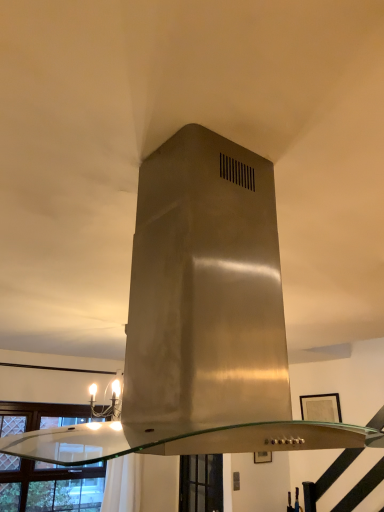
What do you see at coordinates (201, 483) in the screenshot?
I see `clear glass window at lower center, positioned as the first window in right-to-left order` at bounding box center [201, 483].

Locate an element on the screen. Image resolution: width=384 pixels, height=512 pixels. clear glass window at lower center, which is counted as the 2th window, starting from the left is located at coordinates (201, 483).

What is the approximate width of clear glass window at lower left, which is counted as the 1th window, starting from the left?

clear glass window at lower left, which is counted as the 1th window, starting from the left, is 6.08 inches in width.

I want to click on clear glass window at lower left, which is counted as the 1th window, starting from the left, so click(x=49, y=486).

What do you see at coordinates (49, 486) in the screenshot?
I see `clear glass window at lower left, placed as the 2th window when sorted from right to left` at bounding box center [49, 486].

In order to face clear glass window at lower left, placed as the 2th window when sorted from right to left, should I rotate leftwards or rightwards?

It's best to rotate left around 17.975 degrees.

What are the coordinates of `clear glass window at lower center, which is counted as the 2th window, starting from the left` in the screenshot? It's located at (201, 483).

Can you confirm if clear glass window at lower center, which is counted as the 2th window, starting from the left, is positioned to the right of clear glass window at lower left, placed as the 2th window when sorted from right to left?

Yes, clear glass window at lower center, which is counted as the 2th window, starting from the left, is to the right of clear glass window at lower left, placed as the 2th window when sorted from right to left.

In the image, is clear glass window at lower center, which is counted as the 2th window, starting from the left, positioned in front of or behind clear glass window at lower left, which is counted as the 1th window, starting from the left?

clear glass window at lower center, which is counted as the 2th window, starting from the left, is behind clear glass window at lower left, which is counted as the 1th window, starting from the left.

Is point (206, 478) farther from camera compared to point (32, 496)?

That is True.

From the image's perspective, which one is positioned higher, clear glass window at lower center, positioned as the first window in right-to-left order, or clear glass window at lower left, which is counted as the 1th window, starting from the left?

clear glass window at lower left, which is counted as the 1th window, starting from the left, appears higher in the image.

From a real-world perspective, which is physically below, clear glass window at lower center, which is counted as the 2th window, starting from the left, or clear glass window at lower left, which is counted as the 1th window, starting from the left?

clear glass window at lower center, which is counted as the 2th window, starting from the left.

Is clear glass window at lower center, positioned as the first window in right-to-left order, wider than clear glass window at lower left, placed as the 2th window when sorted from right to left?

No.

Can you confirm if clear glass window at lower center, positioned as the first window in right-to-left order, is taller than clear glass window at lower left, which is counted as the 1th window, starting from the left?

No.

In the scene shown: Can you confirm if clear glass window at lower center, positioned as the first window in right-to-left order, is smaller than clear glass window at lower left, which is counted as the 1th window, starting from the left?

Yes.

Would you say clear glass window at lower center, positioned as the first window in right-to-left order, contains clear glass window at lower left, which is counted as the 1th window, starting from the left?

No, clear glass window at lower center, positioned as the first window in right-to-left order, does not contain clear glass window at lower left, which is counted as the 1th window, starting from the left.

Is there a large distance between clear glass window at lower center, which is counted as the 2th window, starting from the left, and clear glass window at lower left, placed as the 2th window when sorted from right to left?

clear glass window at lower center, which is counted as the 2th window, starting from the left, is positioned a significant distance from clear glass window at lower left, placed as the 2th window when sorted from right to left.

Could you tell me if clear glass window at lower center, which is counted as the 2th window, starting from the left, is turned towards clear glass window at lower left, which is counted as the 1th window, starting from the left?

Yes, clear glass window at lower center, which is counted as the 2th window, starting from the left, is turned towards clear glass window at lower left, which is counted as the 1th window, starting from the left.

How different are the orientations of clear glass window at lower center, which is counted as the 2th window, starting from the left, and clear glass window at lower left, which is counted as the 1th window, starting from the left, in degrees?

90.1 degrees.

How far apart are clear glass window at lower center, positioned as the first window in right-to-left order, and clear glass window at lower left, placed as the 2th window when sorted from right to left?

clear glass window at lower center, positioned as the first window in right-to-left order, and clear glass window at lower left, placed as the 2th window when sorted from right to left, are 1.18 meters apart.

This screenshot has width=384, height=512. What are the coordinates of `window on the left of clear glass window at lower center, positioned as the first window in right-to-left order` in the screenshot? It's located at (49, 486).

Based on the photo, which is more to the left, clear glass window at lower left, which is counted as the 1th window, starting from the left, or clear glass window at lower center, positioned as the first window in right-to-left order?

From the viewer's perspective, clear glass window at lower left, which is counted as the 1th window, starting from the left, appears more on the left side.

Is clear glass window at lower left, placed as the 2th window when sorted from right to left, positioned in front of clear glass window at lower center, positioned as the first window in right-to-left order?

Yes, the depth of clear glass window at lower left, placed as the 2th window when sorted from right to left, is less than that of clear glass window at lower center, positioned as the first window in right-to-left order.

Does point (76, 509) come in front of point (186, 477)?

Yes, point (76, 509) is closer to viewer.

From the image's perspective, does clear glass window at lower left, placed as the 2th window when sorted from right to left, appear lower than clear glass window at lower center, which is counted as the 2th window, starting from the left?

Actually, clear glass window at lower left, placed as the 2th window when sorted from right to left, appears above clear glass window at lower center, which is counted as the 2th window, starting from the left, in the image.

From a real-world perspective, which is physically above, clear glass window at lower left, which is counted as the 1th window, starting from the left, or clear glass window at lower center, which is counted as the 2th window, starting from the left?

clear glass window at lower left, which is counted as the 1th window, starting from the left.

From the picture: Does clear glass window at lower left, which is counted as the 1th window, starting from the left, have a greater width compared to clear glass window at lower center, which is counted as the 2th window, starting from the left?

Correct, the width of clear glass window at lower left, which is counted as the 1th window, starting from the left, exceeds that of clear glass window at lower center, which is counted as the 2th window, starting from the left.

Does clear glass window at lower left, which is counted as the 1th window, starting from the left, have a greater height compared to clear glass window at lower center, positioned as the first window in right-to-left order?

Indeed, clear glass window at lower left, which is counted as the 1th window, starting from the left, has a greater height compared to clear glass window at lower center, positioned as the first window in right-to-left order.

Considering the sizes of objects clear glass window at lower left, which is counted as the 1th window, starting from the left, and clear glass window at lower center, which is counted as the 2th window, starting from the left, in the image provided, who is bigger, clear glass window at lower left, which is counted as the 1th window, starting from the left, or clear glass window at lower center, which is counted as the 2th window, starting from the left,?

clear glass window at lower left, which is counted as the 1th window, starting from the left.

Can we say clear glass window at lower left, which is counted as the 1th window, starting from the left, lies outside clear glass window at lower center, positioned as the first window in right-to-left order?

Indeed, clear glass window at lower left, which is counted as the 1th window, starting from the left, is completely outside clear glass window at lower center, positioned as the first window in right-to-left order.

In the scene shown: Is clear glass window at lower left, which is counted as the 1th window, starting from the left, directly adjacent to clear glass window at lower center, positioned as the first window in right-to-left order?

No, clear glass window at lower left, which is counted as the 1th window, starting from the left, is not next to clear glass window at lower center, positioned as the first window in right-to-left order.

Is clear glass window at lower left, placed as the 2th window when sorted from right to left, facing away from clear glass window at lower center, which is counted as the 2th window, starting from the left?

No, clear glass window at lower left, placed as the 2th window when sorted from right to left, is not facing away from clear glass window at lower center, which is counted as the 2th window, starting from the left.

How many degrees apart are the facing directions of clear glass window at lower left, which is counted as the 1th window, starting from the left, and clear glass window at lower center, positioned as the first window in right-to-left order?

90.1 degrees separate the facing orientations of clear glass window at lower left, which is counted as the 1th window, starting from the left, and clear glass window at lower center, positioned as the first window in right-to-left order.

Find the location of a particular element. The height and width of the screenshot is (512, 384). window below the clear glass window at lower left, placed as the 2th window when sorted from right to left (from the image's perspective) is located at coordinates (201, 483).

Where is `window above the clear glass window at lower center, positioned as the first window in right-to-left order (from the image's perspective)`? This screenshot has height=512, width=384. window above the clear glass window at lower center, positioned as the first window in right-to-left order (from the image's perspective) is located at coordinates (49, 486).

The image size is (384, 512). Find the location of `window below the clear glass window at lower left, which is counted as the 1th window, starting from the left (from a real-world perspective)`. window below the clear glass window at lower left, which is counted as the 1th window, starting from the left (from a real-world perspective) is located at coordinates (201, 483).